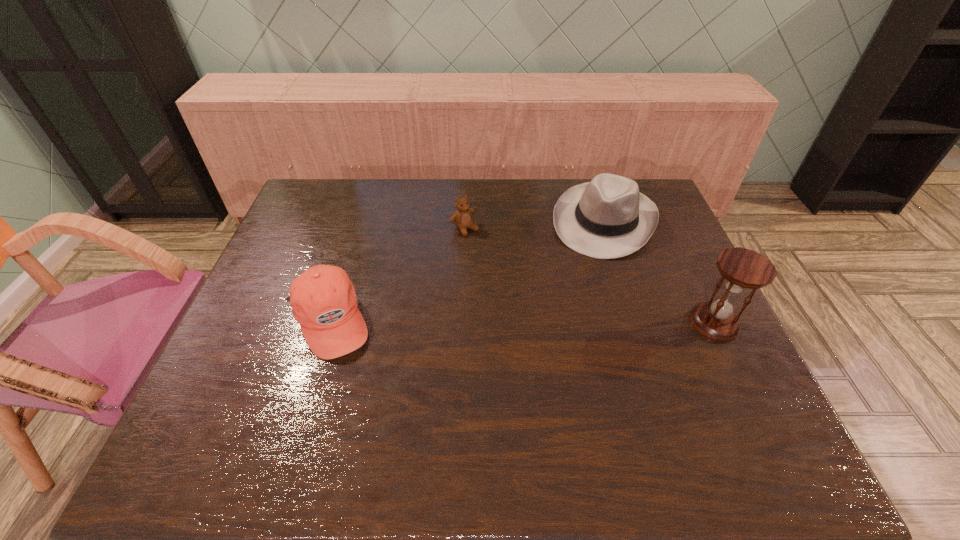
Locate an element on the screen. free spot on the desktop that is between the leftmost object and the hourglass and is positioned on the front-facing side of the teddy bear is located at coordinates (566, 322).

Locate an element on the screen. vacant spot on the desktop that is between the leftmost object and the hourglass and is positioned on the front-facing side of the fedora is located at coordinates (564, 322).